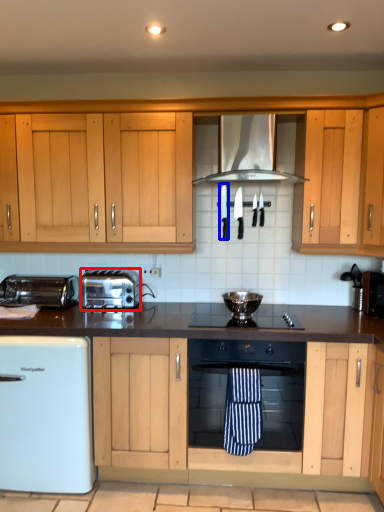
Question: Among these objects, which one is farthest to the camera, toaster (highlighted by a red box) or appliance (highlighted by a blue box)?

Choices:
 (A) toaster
 (B) appliance

Answer: (B)